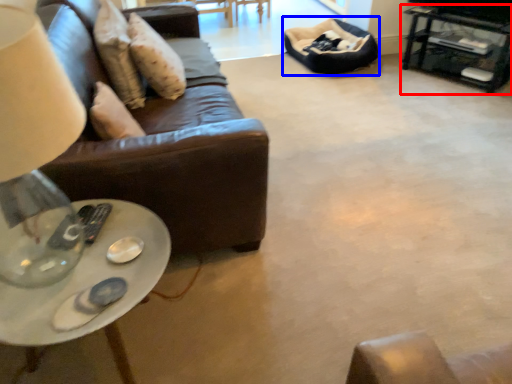
Question: Which object is further to the camera taking this photo, table (highlighted by a red box) or bean bag chair (highlighted by a blue box)?

Choices:
 (A) table
 (B) bean bag chair

Answer: (B)